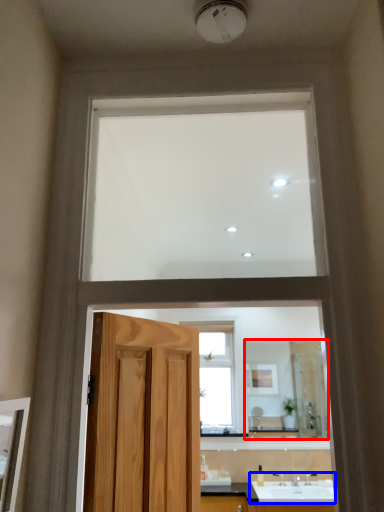
Question: Which of the following is the farthest to the observer, mirror (highlighted by a red box) or sink (highlighted by a blue box)?

Choices:
 (A) mirror
 (B) sink

Answer: (A)